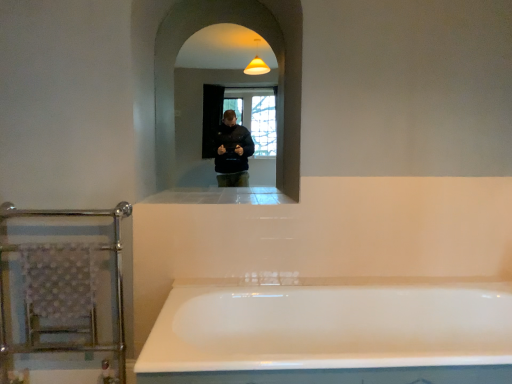
Question: Is clear glass mirror at center at the left side of white glossy ledge at center?

Choices:
 (A) yes
 (B) no

Answer: (A)

Question: Is clear glass mirror at center taller than white glossy ledge at center?

Choices:
 (A) yes
 (B) no

Answer: (A)

Question: From a real-world perspective, is clear glass mirror at center positioned over white glossy ledge at center based on gravity?

Choices:
 (A) no
 (B) yes

Answer: (B)

Question: From the image's perspective, is clear glass mirror at center over white glossy ledge at center?

Choices:
 (A) yes
 (B) no

Answer: (A)

Question: Are clear glass mirror at center and white glossy ledge at center making contact?

Choices:
 (A) no
 (B) yes

Answer: (A)

Question: Is white glossy bathtub at center taller or shorter than white glossy ledge at center?

Choices:
 (A) tall
 (B) short

Answer: (A)

Question: From the image's perspective, is white glossy bathtub at center located above or below white glossy ledge at center?

Choices:
 (A) above
 (B) below

Answer: (B)

Question: Considering the relative positions of white glossy bathtub at center and white glossy ledge at center in the image provided, is white glossy bathtub at center to the left or to the right of white glossy ledge at center?

Choices:
 (A) right
 (B) left

Answer: (A)

Question: In terms of width, does white glossy bathtub at center look wider or thinner when compared to white glossy ledge at center?

Choices:
 (A) thin
 (B) wide

Answer: (B)

Question: Based on their sizes in the image, would you say white glossy ledge at center is bigger or smaller than white glossy bathtub at center?

Choices:
 (A) small
 (B) big

Answer: (A)

Question: From a real-world perspective, relative to white glossy bathtub at center, is white glossy ledge at center vertically above or below?

Choices:
 (A) below
 (B) above

Answer: (B)

Question: In the image, is white glossy ledge at center positioned in front of or behind white glossy bathtub at center?

Choices:
 (A) front
 (B) behind

Answer: (B)

Question: Considering the positions of point (160, 195) and point (228, 336), is point (160, 195) closer or farther from the camera than point (228, 336)?

Choices:
 (A) farther
 (B) closer

Answer: (A)

Question: Does point (385, 324) appear closer or farther from the camera than point (115, 266)?

Choices:
 (A) farther
 (B) closer

Answer: (B)

Question: Is white glossy bathtub at center in front of or behind chrome metallic towel rack at left in the image?

Choices:
 (A) front
 (B) behind

Answer: (A)